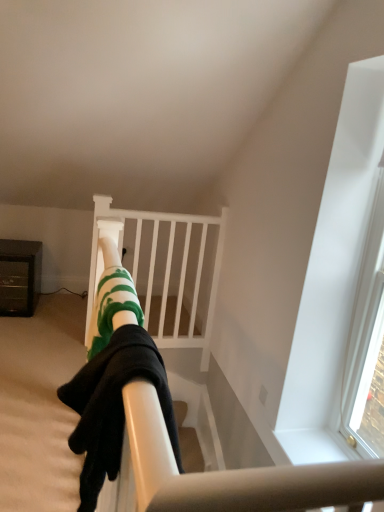
Question: From a real-world perspective, is brushed metal cabinet at left positioned under green striped socks at center based on gravity?

Choices:
 (A) no
 (B) yes

Answer: (B)

Question: Is brushed metal cabinet at left to the right of green striped socks at center from the viewer's perspective?

Choices:
 (A) no
 (B) yes

Answer: (A)

Question: Is brushed metal cabinet at left oriented towards green striped socks at center?

Choices:
 (A) no
 (B) yes

Answer: (B)

Question: Is brushed metal cabinet at left thinner than green striped socks at center?

Choices:
 (A) yes
 (B) no

Answer: (B)

Question: Can you confirm if brushed metal cabinet at left is positioned to the left of green striped socks at center?

Choices:
 (A) yes
 (B) no

Answer: (A)

Question: Is point (107, 472) positioned closer to the camera than point (192, 245)?

Choices:
 (A) closer
 (B) farther

Answer: (A)

Question: From the image's perspective, is green striped socks at center positioned above or below white matte bunk bed at center?

Choices:
 (A) below
 (B) above

Answer: (A)

Question: Based on their sizes in the image, would you say green striped socks at center is bigger or smaller than white matte bunk bed at center?

Choices:
 (A) big
 (B) small

Answer: (B)

Question: Is green striped socks at center situated inside white matte bunk bed at center or outside?

Choices:
 (A) outside
 (B) inside

Answer: (A)

Question: Is point (150, 311) closer or farther from the camera than point (4, 263)?

Choices:
 (A) closer
 (B) farther

Answer: (B)

Question: Is white matte bunk bed at center inside or outside of brushed metal cabinet at left?

Choices:
 (A) inside
 (B) outside

Answer: (B)

Question: Considering the positions of white matte bunk bed at center and brushed metal cabinet at left in the image, is white matte bunk bed at center wider or thinner than brushed metal cabinet at left?

Choices:
 (A) wide
 (B) thin

Answer: (B)

Question: Is white matte bunk bed at center taller or shorter than brushed metal cabinet at left?

Choices:
 (A) short
 (B) tall

Answer: (B)

Question: Do you think green striped socks at center is within brushed metal cabinet at left, or outside of it?

Choices:
 (A) inside
 (B) outside

Answer: (B)

Question: Would you say green striped socks at center is to the left or to the right of brushed metal cabinet at left in the picture?

Choices:
 (A) left
 (B) right

Answer: (B)